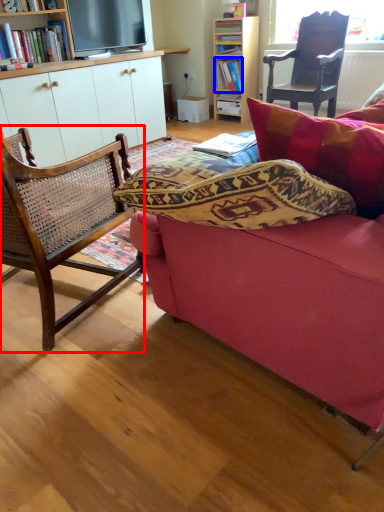
Question: Which object is further to the camera taking this photo, chair (highlighted by a red box) or book (highlighted by a blue box)?

Choices:
 (A) chair
 (B) book

Answer: (B)